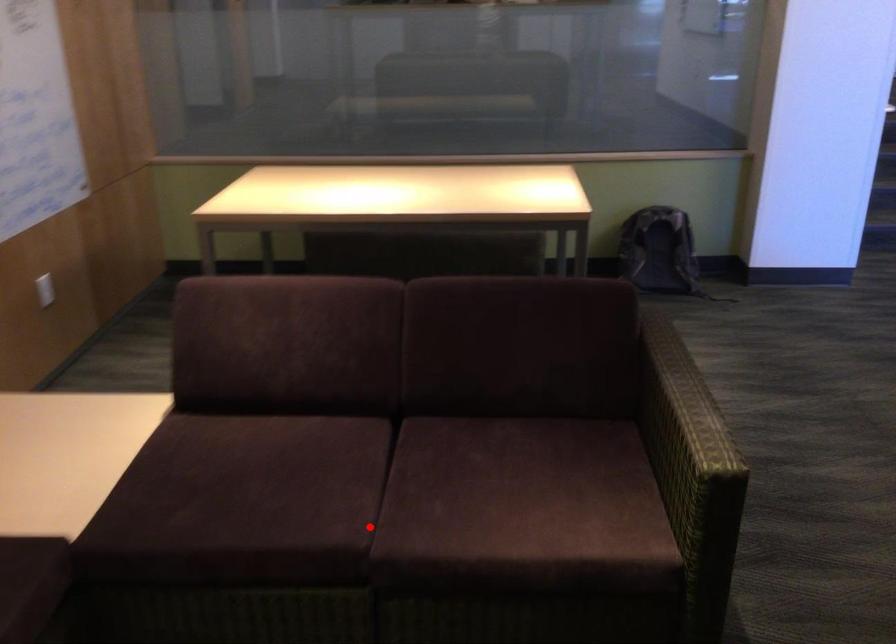
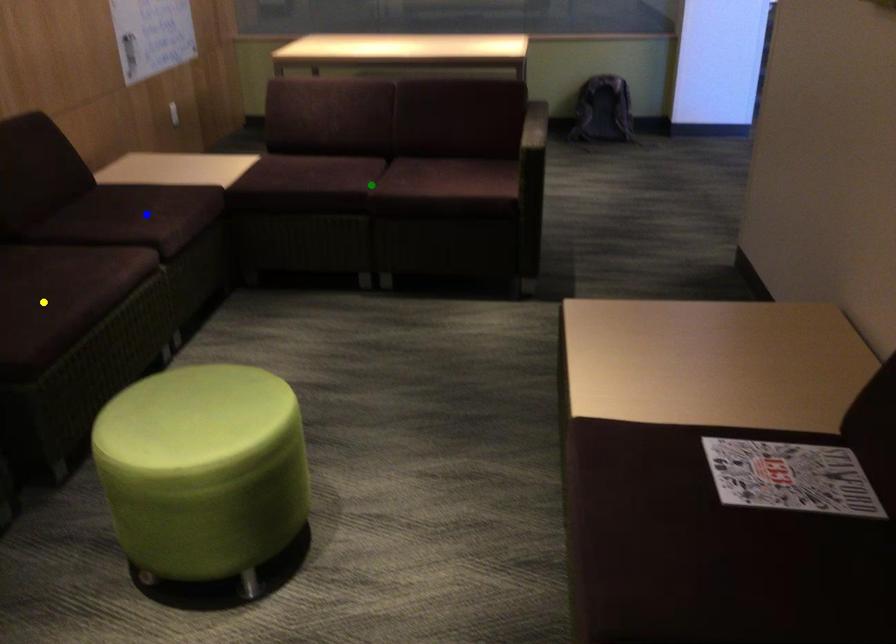
Question: I am providing you with two images of the same scene from different viewpoints. A red point is marked on the first image. You are given multiple points on the second image. Which point in image 2 represents the same 3d spot as the red point in image 1?

Choices:
 (A) green point
 (B) blue point
 (C) yellow point

Answer: (A)